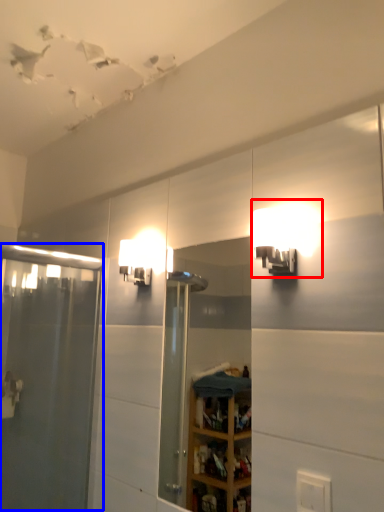
Question: Which of the following is the closest to the observer, light fixture (highlighted by a red box) or screen door (highlighted by a blue box)?

Choices:
 (A) light fixture
 (B) screen door

Answer: (A)